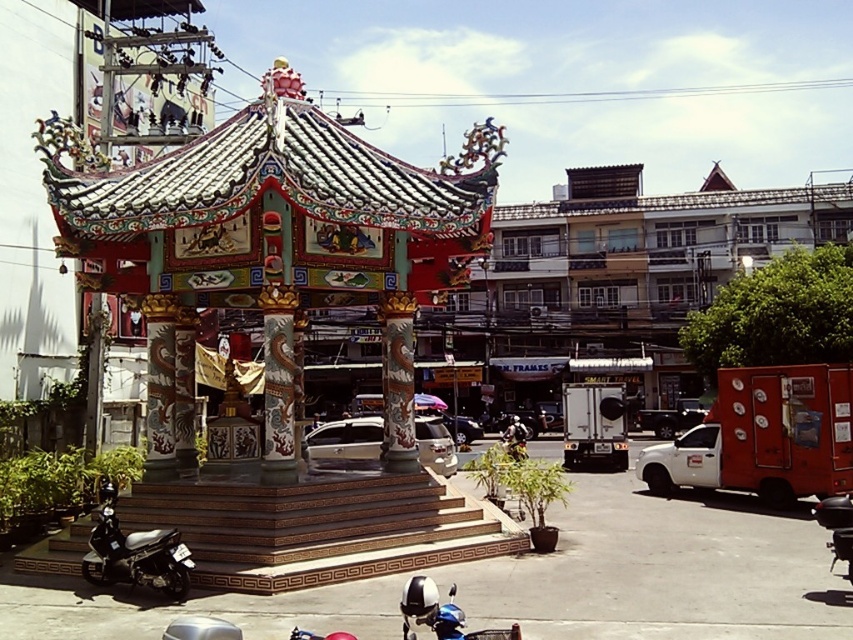
Question: Which point is closer to the camera?

Choices:
 (A) [x=171, y=548]
 (B) [x=440, y=205]
 (C) [x=402, y=624]

Answer: (C)

Question: Which point appears farthest from the camera in this image?

Choices:
 (A) (425, 582)
 (B) (428, 550)
 (C) (177, 588)

Answer: (B)

Question: Which object is closer to the camera taking this photo?

Choices:
 (A) black matte motorcycle at lower left
 (B) polychrome painted gazebo at center

Answer: (A)

Question: Does polychrome painted gazebo at center appear over blue metallic motorcycle at lower center?

Choices:
 (A) yes
 (B) no

Answer: (A)

Question: From the image, what is the correct spatial relationship of black matte motorcycle at lower left in relation to blue metallic motorcycle at lower center?

Choices:
 (A) below
 (B) above

Answer: (A)

Question: Is polychrome painted gazebo at center further to the viewer compared to black matte motorcycle at lower left?

Choices:
 (A) yes
 (B) no

Answer: (A)